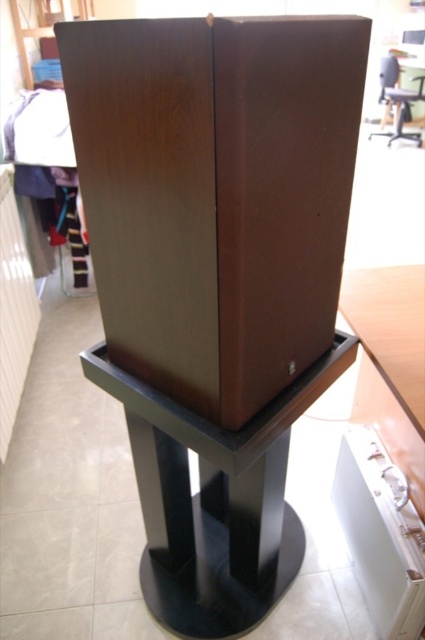
Question: Can you confirm if wooden speaker at center is positioned below black matte table at center?

Choices:
 (A) no
 (B) yes

Answer: (A)

Question: Does wooden speaker at center appear under black matte table at center?

Choices:
 (A) yes
 (B) no

Answer: (B)

Question: Which object appears closest to the camera in this image?

Choices:
 (A) wooden speaker at center
 (B) black matte table at center

Answer: (A)

Question: Is wooden speaker at center further to the viewer compared to black matte table at center?

Choices:
 (A) no
 (B) yes

Answer: (A)